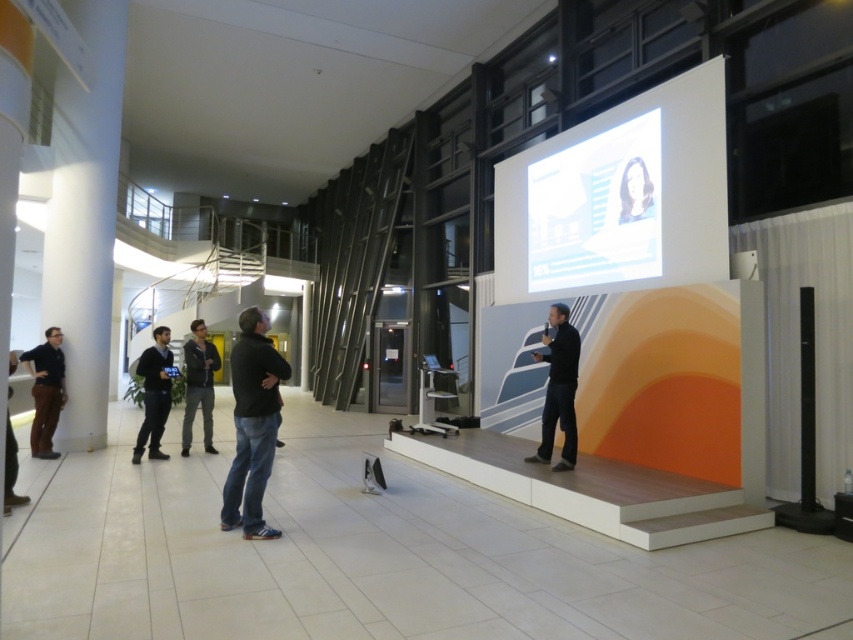
You are an event planner organizing a photo shoot in this space. You need to position two models wearing the matte black shirt at left and the dark gray sweater at lower left so that their outfits are clearly visible in the photos. Based on their current positions, which model should you move to ensure both outfits are well lit and visible?

The matte black shirt at left is located above the dark gray sweater at lower left. To ensure both outfits are well lit, move the model wearing the dark gray sweater at lower left to a higher position so that both are in the same lighting level.

Consider the image. You are an event organizer and need to place a 0.3 meters wide decorative stand exactly at point [252,424]. Will the dark gray sweater at center interfere with the placement?

The dark gray sweater at center is located at point [252,424], so placing the decorative stand there would overlap with the dark gray sweater at center. Choose another location.

You are an event coordinator trying to ensure presenters are visible to the audience. The dark gray sweater at center and the black matte jacket at center are both worn by the presenter. Which clothing item is closer to the camera?

The dark gray sweater at center is located below the black matte jacket at center, meaning the black matte jacket at center is closer to the camera.